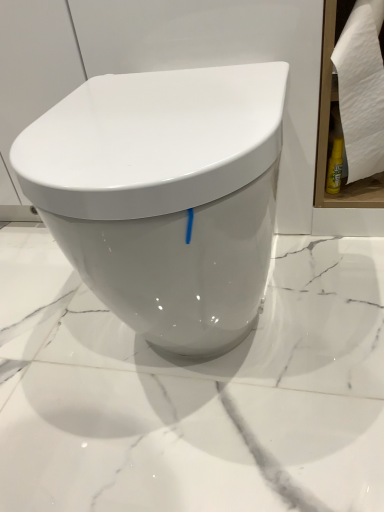
Describe the element at coordinates (165, 195) in the screenshot. I see `white glossy toilet at center` at that location.

Identify the location of white glossy toilet at center. This screenshot has width=384, height=512. (165, 195).

Measure the distance between white glossy toilet at center and camera.

A distance of 43.20 centimeters exists between white glossy toilet at center and camera.

In order to face white paper towel at right, should I rotate leftwards or rightwards?

To face it directly, rotate right by 22.179 degrees.

Where is `white paper towel at right`? The height and width of the screenshot is (512, 384). white paper towel at right is located at coordinates (361, 89).

The image size is (384, 512). What do you see at coordinates (361, 89) in the screenshot?
I see `white paper towel at right` at bounding box center [361, 89].

You are a GUI agent. You are given a task and a screenshot of the screen. Output one action in this format:
    pyautogui.click(x=<x>, y=<y>)
    Task: Click on the white glossy toilet at center
    The height and width of the screenshot is (512, 384).
    Given the screenshot: What is the action you would take?
    pyautogui.click(x=165, y=195)

Between white glossy toilet at center and white paper towel at right, which one appears on the right side from the viewer's perspective?

white paper towel at right is more to the right.

Who is more distant, white glossy toilet at center or white paper towel at right?

white paper towel at right is more distant.

Is point (184, 151) closer to viewer compared to point (380, 135)?

Yes, it is.

From the image's perspective, which one is positioned lower, white glossy toilet at center or white paper towel at right?

white glossy toilet at center.

From a real-world perspective, is white glossy toilet at center beneath white paper towel at right?

Yes, from a real-world perspective, white glossy toilet at center is beneath white paper towel at right.

Looking at their sizes, would you say white glossy toilet at center is wider or thinner than white paper towel at right?

In the image, white glossy toilet at center appears to be wider than white paper towel at right.

Between white glossy toilet at center and white paper towel at right, which one has less height?

Standing shorter between the two is white paper towel at right.

Considering the sizes of white glossy toilet at center and white paper towel at right in the image, is white glossy toilet at center bigger or smaller than white paper towel at right?

white glossy toilet at center is bigger than white paper towel at right.

Could white paper towel at right be considered to be inside white glossy toilet at center?

No, white paper towel at right is located outside of white glossy toilet at center.

Is white glossy toilet at center not near white paper towel at right?

They are positioned close to each other.

Is white glossy toilet at center positioned with its back to white paper towel at right?

No, white paper towel at right is not at the back of white glossy toilet at center.

What's the angular difference between white glossy toilet at center and white paper towel at right's facing directions?

0.4 degrees separate the facing orientations of white glossy toilet at center and white paper towel at right.

The width and height of the screenshot is (384, 512). In the image, there is a white paper towel at right. In order to click on toilet below it (from a real-world perspective) in this screenshot , I will do point(165,195).

Is white paper towel at right to the left of white glossy toilet at center from the viewer's perspective?

Incorrect, white paper towel at right is not on the left side of white glossy toilet at center.

Consider the image. In the image, is white paper towel at right positioned in front of or behind white glossy toilet at center?

Clearly, white paper towel at right is behind white glossy toilet at center.

Considering the positions of point (338, 61) and point (31, 181), is point (338, 61) closer or farther from the camera than point (31, 181)?

Point (338, 61) is positioned farther from the camera compared to point (31, 181).

From the image's perspective, which one is positioned higher, white paper towel at right or white glossy toilet at center?

From the image's view, white paper towel at right is above.

From a real-world perspective, is white paper towel at right under white glossy toilet at center?

Incorrect, from a real-world perspective, white paper towel at right is higher than white glossy toilet at center.

Between white paper towel at right and white glossy toilet at center, which one has larger width?

white glossy toilet at center.

Does white paper towel at right have a greater height compared to white glossy toilet at center?

No, white paper towel at right is not taller than white glossy toilet at center.

Does white paper towel at right have a smaller size compared to white glossy toilet at center?

Correct, white paper towel at right occupies less space than white glossy toilet at center.

Can we say white paper towel at right lies outside white glossy toilet at center?

Yes.

Is white paper towel at right touching white glossy toilet at center?

They are not placed beside each other.

Could you tell me if white paper towel at right is turned towards white glossy toilet at center?

No, white paper towel at right does not turn towards white glossy toilet at center.

Can you tell me how much white paper towel at right and white glossy toilet at center differ in facing direction?

0.4 degrees.

The height and width of the screenshot is (512, 384). I want to click on toilet below the white paper towel at right (from the image's perspective), so (165, 195).

Locate an element on the screen. The image size is (384, 512). toilet below the white paper towel at right (from the image's perspective) is located at coordinates (165, 195).

Where is `toilet to the left of white paper towel at right`? toilet to the left of white paper towel at right is located at coordinates (165, 195).